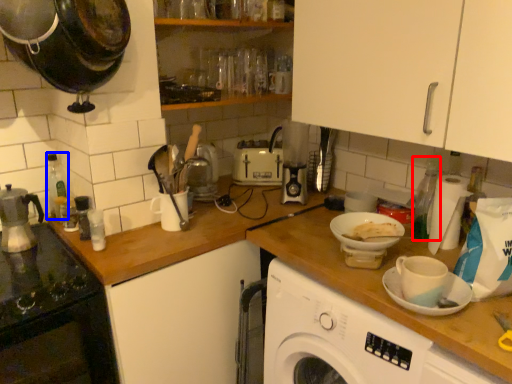
Question: Among these objects, which one is farthest to the camera, bottle (highlighted by a red box) or bottle (highlighted by a blue box)?

Choices:
 (A) bottle
 (B) bottle

Answer: (B)